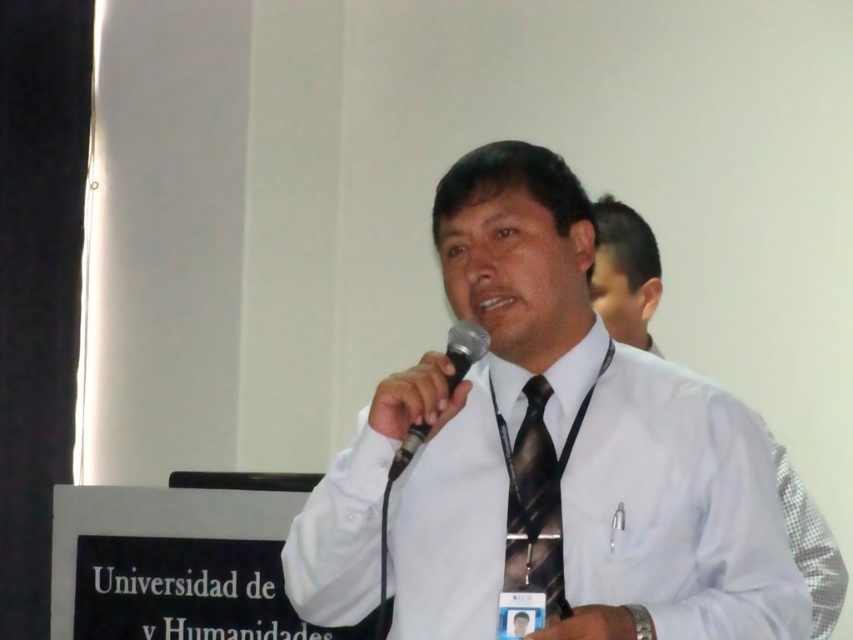
Question: Can you confirm if white glossy shirt at center is bigger than black striped tie at center?

Choices:
 (A) yes
 (B) no

Answer: (A)

Question: Is white shirt at center closer to camera compared to black plastic microphone at center?

Choices:
 (A) yes
 (B) no

Answer: (B)

Question: Based on their relative distances, which object is farther from the white shirt at center?

Choices:
 (A) black striped tie at center
 (B) black plastic microphone at center
 (C) white glossy shirt at center

Answer: (B)

Question: Among these points, which one is farthest from the camera?

Choices:
 (A) (631, 308)
 (B) (544, 532)
 (C) (456, 342)

Answer: (A)

Question: Is white glossy shirt at center above white shirt at center?

Choices:
 (A) no
 (B) yes

Answer: (A)

Question: Which point appears closest to the camera in this image?

Choices:
 (A) (459, 211)
 (B) (395, 476)

Answer: (B)